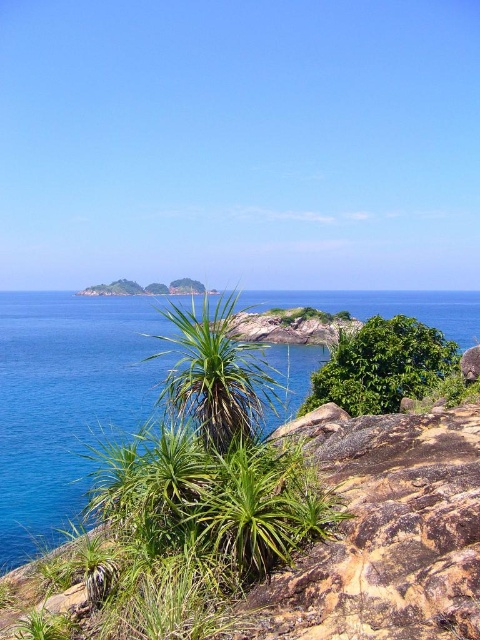
You are standing on the rocky outcrop and want to reach the blue clear water at center. There is a green leafy plant at center in your way. Can you walk around it without stepping on the plant?

The blue clear water at center is much taller than the green leafy plant at center, so you can walk around the green leafy plant at center by stepping over it since it is shorter.

You are standing at the point marked by the coordinates (216, 376) in the coastal landscape. Looking around, you see a pandanus plant with long, slender leaves and other smaller plants. Which direction should you walk to reach the pandanus plant?

The point marked by the coordinates (216, 376) corresponds to the green leafy plant at center. Since the pandanus plant with long, slender leaves is the prominent one standing out due to its height and vibrant green color, it is likely located away from the center. To reach it, you should walk towards the direction where the pandanus plant is situated, which is not specified in the coordinates but can be inferred from the scene description.

You are a hiker who has just arrived at the coastal area. You see the blue clear water at center and the green leafy bush at center. Which one is higher in elevation?

The blue clear water at center is above the green leafy bush at center, so the blue clear water at center is higher in elevation.